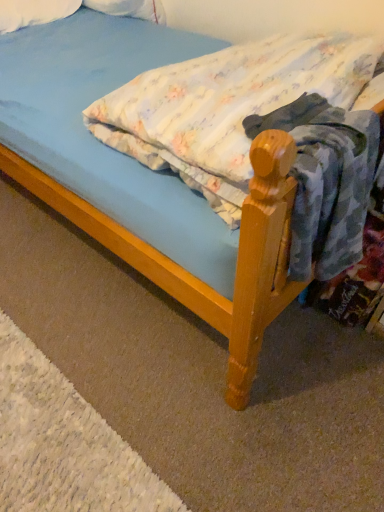
Find the location of `light blue fabric mattress at center`. light blue fabric mattress at center is located at coordinates (267, 129).

This screenshot has height=512, width=384. What do you see at coordinates (267, 129) in the screenshot? I see `light blue fabric mattress at center` at bounding box center [267, 129].

Where is `white soft pillow at upper left`? This screenshot has width=384, height=512. white soft pillow at upper left is located at coordinates (33, 12).

What is the approximate width of white soft pillow at upper left?

white soft pillow at upper left is 17.13 inches in width.

The image size is (384, 512). What do you see at coordinates (33, 12) in the screenshot? I see `white soft pillow at upper left` at bounding box center [33, 12].

This screenshot has width=384, height=512. I want to click on light blue fabric mattress at center, so click(267, 129).

Is light blue fabric mattress at center at the left side of white soft pillow at upper left?

No.

Is light blue fabric mattress at center behind white soft pillow at upper left?

That is False.

Is point (210, 147) positioned after point (18, 26)?

No, it is in front of (18, 26).

From the image's perspective, is light blue fabric mattress at center located beneath white soft pillow at upper left?

Yes, from the image's perspective, light blue fabric mattress at center is beneath white soft pillow at upper left.

From a real-world perspective, who is located higher, light blue fabric mattress at center or white soft pillow at upper left?

light blue fabric mattress at center.

Between light blue fabric mattress at center and white soft pillow at upper left, which one has smaller width?

white soft pillow at upper left is thinner.

Is light blue fabric mattress at center taller than white soft pillow at upper left?

Indeed, light blue fabric mattress at center has a greater height compared to white soft pillow at upper left.

Consider the image. Considering the sizes of light blue fabric mattress at center and white soft pillow at upper left in the image, is light blue fabric mattress at center bigger or smaller than white soft pillow at upper left?

Clearly, light blue fabric mattress at center is larger in size than white soft pillow at upper left.

Can we say light blue fabric mattress at center lies outside white soft pillow at upper left?

Yes.

Are light blue fabric mattress at center and white soft pillow at upper left far apart?

Result: Yes, light blue fabric mattress at center is far from white soft pillow at upper left.

Could you tell me if light blue fabric mattress at center is facing white soft pillow at upper left?

Yes, light blue fabric mattress at center is turned towards white soft pillow at upper left.

Find the location of a particular element. This screenshot has height=512, width=384. pillow located underneath the light blue fabric mattress at center (from a real-world perspective) is located at coordinates pyautogui.click(x=33, y=12).

Visually, is white soft pillow at upper left positioned to the left or to the right of light blue fabric mattress at center?

white soft pillow at upper left is to the left of light blue fabric mattress at center.

Considering their positions, is white soft pillow at upper left located in front of or behind light blue fabric mattress at center?

white soft pillow at upper left is behind light blue fabric mattress at center.

Between point (64, 17) and point (328, 50), which one is positioned in front?

The point (328, 50) is more forward.

From the image's perspective, which object appears higher, white soft pillow at upper left or light blue fabric mattress at center?

white soft pillow at upper left is shown above in the image.

From a real-world perspective, is white soft pillow at upper left below light blue fabric mattress at center?

Yes, from a real-world perspective, white soft pillow at upper left is under light blue fabric mattress at center.

In terms of width, does white soft pillow at upper left look wider or thinner when compared to light blue fabric mattress at center?

Clearly, white soft pillow at upper left has less width compared to light blue fabric mattress at center.

Is white soft pillow at upper left shorter than light blue fabric mattress at center?

Yes.

Considering the sizes of white soft pillow at upper left and light blue fabric mattress at center in the image, is white soft pillow at upper left bigger or smaller than light blue fabric mattress at center?

Considering their sizes, white soft pillow at upper left takes up less space than light blue fabric mattress at center.

Is white soft pillow at upper left situated inside light blue fabric mattress at center or outside?

white soft pillow at upper left is spatially situated outside light blue fabric mattress at center.

Is white soft pillow at upper left positioned far away from light blue fabric mattress at center?

Yes.

Is white soft pillow at upper left oriented away from light blue fabric mattress at center?

No, white soft pillow at upper left is not facing the opposite direction of light blue fabric mattress at center.

What's the angular difference between white soft pillow at upper left and light blue fabric mattress at center's facing directions?

The angular difference between white soft pillow at upper left and light blue fabric mattress at center is 175 degrees.

Locate an element on the screen. This screenshot has width=384, height=512. pillow that appears above the light blue fabric mattress at center (from the image's perspective) is located at coordinates (33, 12).

At what (x,y) coordinates should I click in order to perform the action: click on mattress that is in front of the white soft pillow at upper left. Please return your answer as a coordinate pair (x, y). The width and height of the screenshot is (384, 512). Looking at the image, I should click on (267, 129).

This screenshot has height=512, width=384. In order to click on mattress that is on the right side of white soft pillow at upper left in this screenshot , I will do `click(267, 129)`.